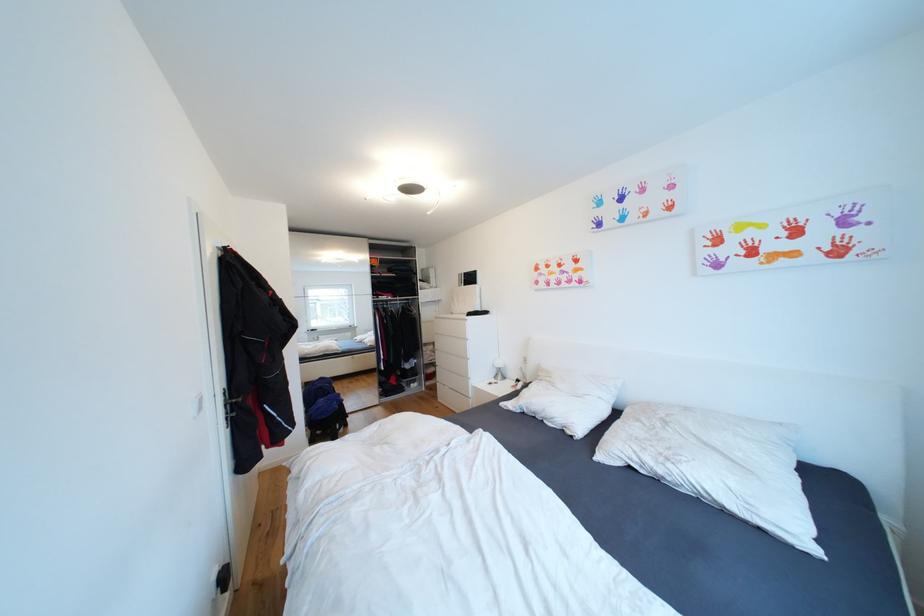
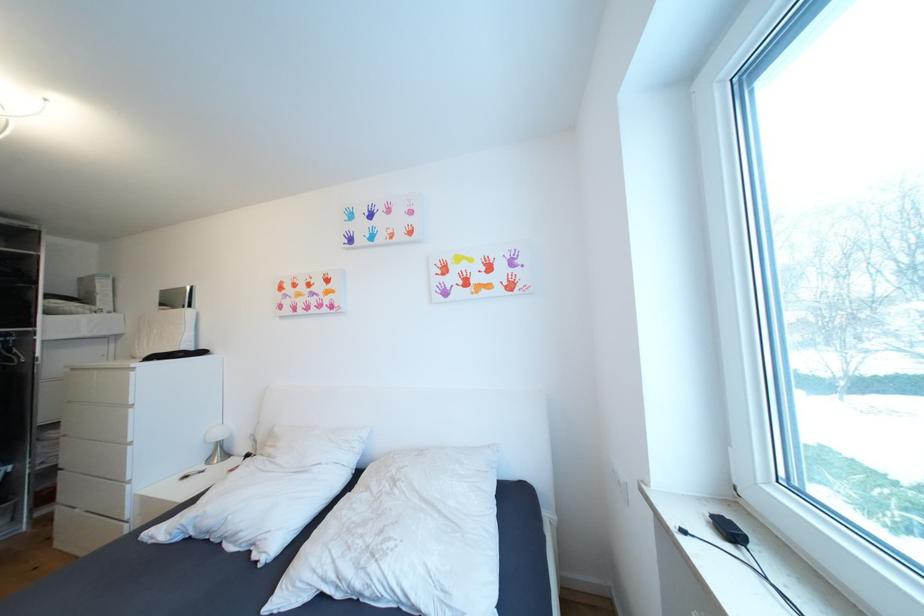
Question: Based on the continuous images, in which direction is the camera rotating? Reply with the corresponding letter.

Choices:
 (A) Left
 (B) Right
 (C) Up
 (D) Down

Answer: (B)